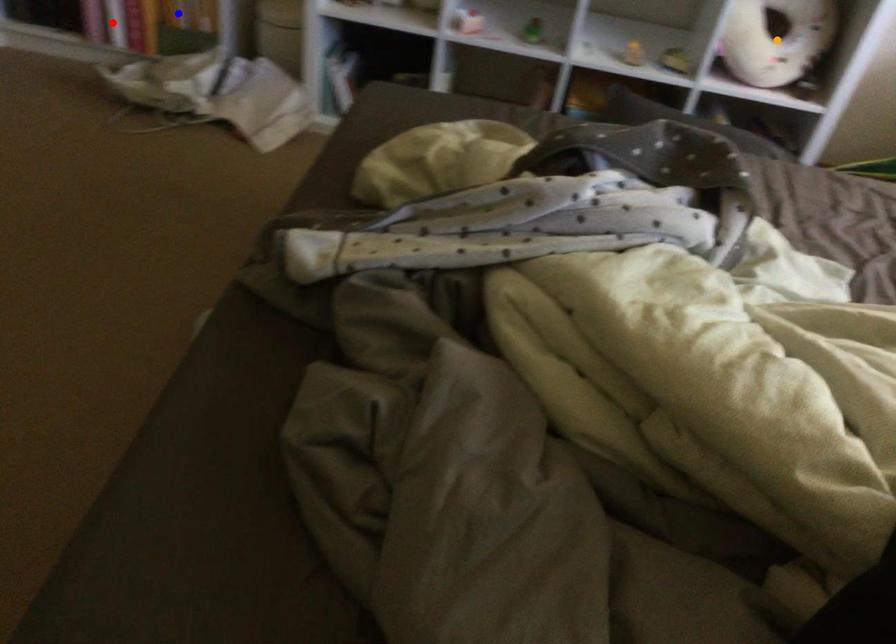
Order these from nearest to farthest:
orange point, blue point, red point

blue point
red point
orange point